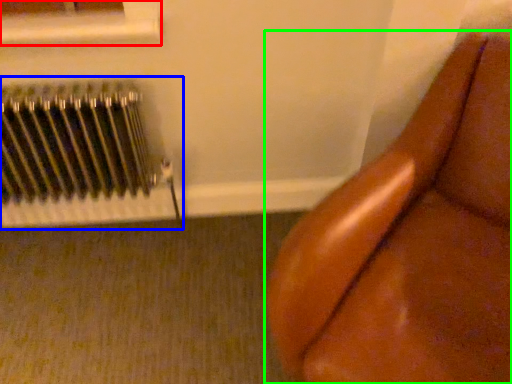
Question: Based on their relative distances, which object is farther from window frame (highlighted by a red box)? Choose from radiator (highlighted by a blue box) and furniture (highlighted by a green box).

Choices:
 (A) radiator
 (B) furniture

Answer: (B)